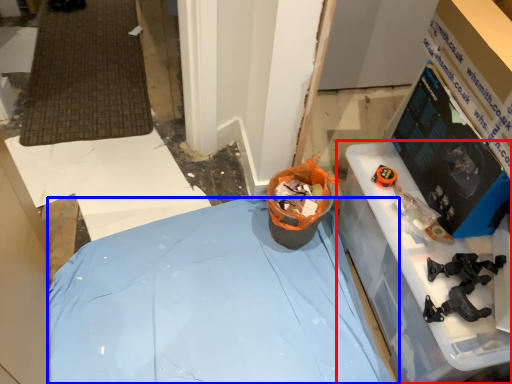
Question: Which point is further to the camera, furniture (highlighted by a red box) or furniture (highlighted by a blue box)?

Choices:
 (A) furniture
 (B) furniture

Answer: (B)